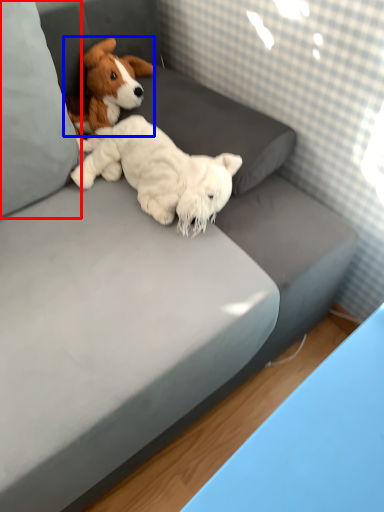
Question: Which object appears closest to the camera in this image, pillow (highlighted by a red box) or dog (highlighted by a blue box)?

Choices:
 (A) pillow
 (B) dog

Answer: (A)